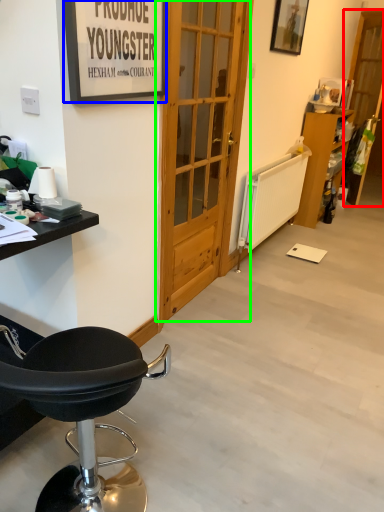
Question: Which object is positioned closest to screen door (highlighted by a red box)? Select from picture frame (highlighted by a blue box) and door (highlighted by a green box).

Choices:
 (A) picture frame
 (B) door

Answer: (B)